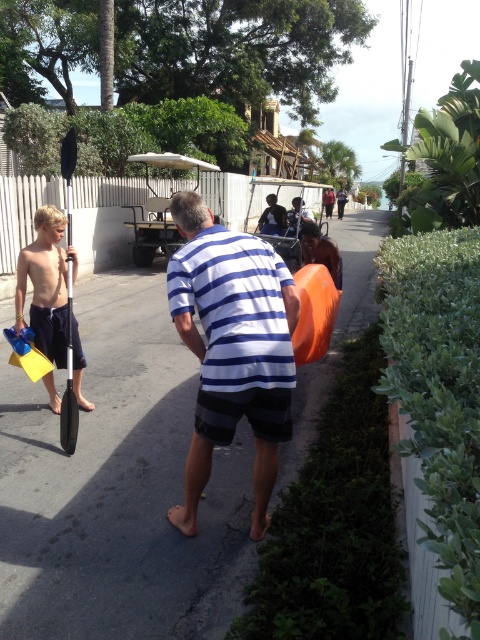
Who is positioned more to the left, gray asphalt pavement at center or yellow matte flippers at left?

From the viewer's perspective, yellow matte flippers at left appears more on the left side.

Does gray asphalt pavement at center come in front of yellow matte flippers at left?

Yes, gray asphalt pavement at center is in front of yellow matte flippers at left.

Describe the element at coordinates (119, 486) in the screenshot. I see `gray asphalt pavement at center` at that location.

Where is `gray asphalt pavement at center`? This screenshot has width=480, height=640. gray asphalt pavement at center is located at coordinates (119, 486).

Is white striped shirt at center bigger than yellow matte flippers at left?

Yes.

Does white striped shirt at center lie behind yellow matte flippers at left?

No, white striped shirt at center is closer to the viewer.

Between point (259, 243) and point (40, 316), which one is positioned in front?

Point (259, 243) is more forward.

You are a GUI agent. You are given a task and a screenshot of the screen. Output one action in this format:
    pyautogui.click(x=<x>, y=<y>)
    Task: Click on the white striped shirt at center
    
    Given the screenshot: What is the action you would take?
    pyautogui.click(x=231, y=348)

Is gray asphalt pavement at center below white striped shirt at center?

Actually, gray asphalt pavement at center is above white striped shirt at center.

Which is below, gray asphalt pavement at center or white striped shirt at center?

white striped shirt at center is below.

Locate an element on the screen. The height and width of the screenshot is (640, 480). gray asphalt pavement at center is located at coordinates pos(119,486).

You are a GUI agent. You are given a task and a screenshot of the screen. Output one action in this format:
    pyautogui.click(x=<x>, y=<y>)
    Task: Click on the gray asphalt pavement at center
    
    Given the screenshot: What is the action you would take?
    pyautogui.click(x=119, y=486)